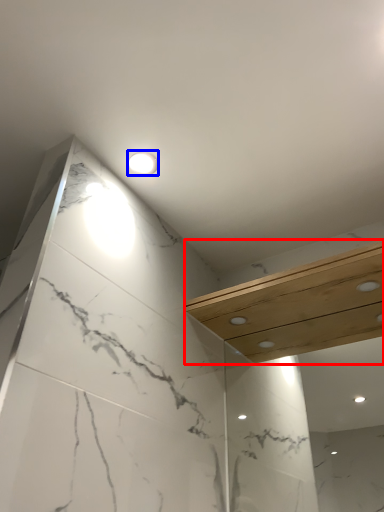
Question: Which point is closer to the camera, balustrade (highlighted by a red box) or light fixture (highlighted by a blue box)?

Choices:
 (A) balustrade
 (B) light fixture

Answer: (A)